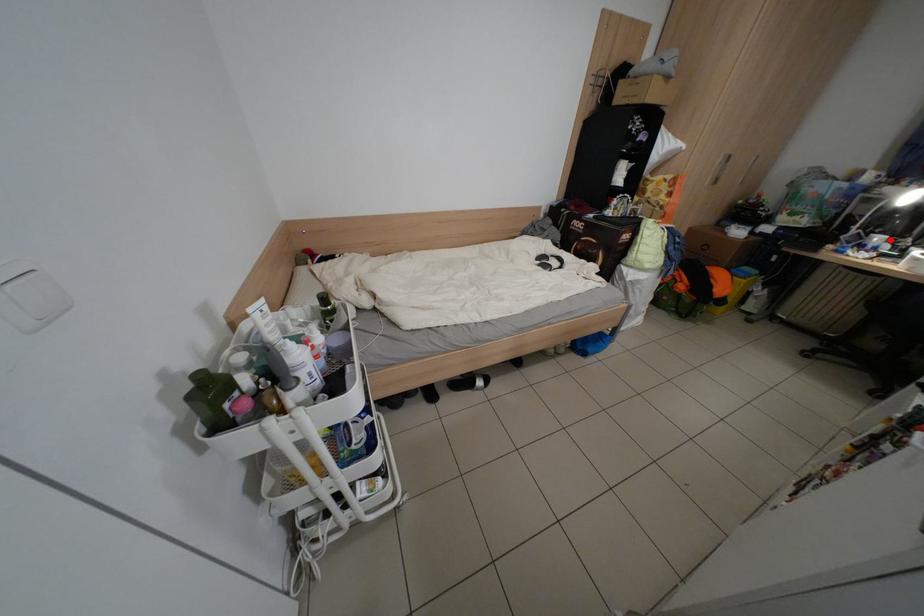
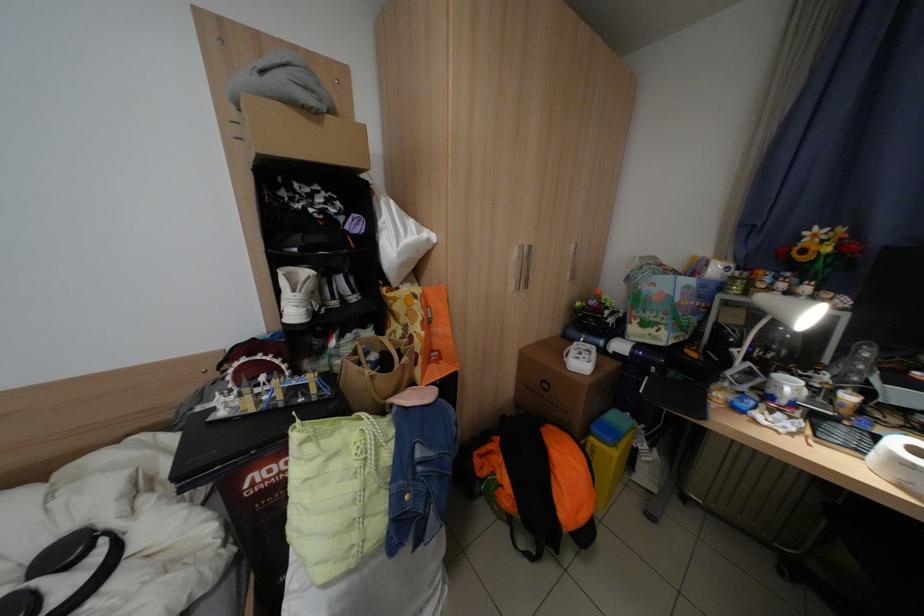
Question: A red point is marked in image1. In image2, is the corresponding 3D point closer to the camera or farther? Reply with the corresponding letter.

Choices:
 (A) The corresponding 3D point is closer.
 (B) The corresponding 3D point is farther.

Answer: (A)